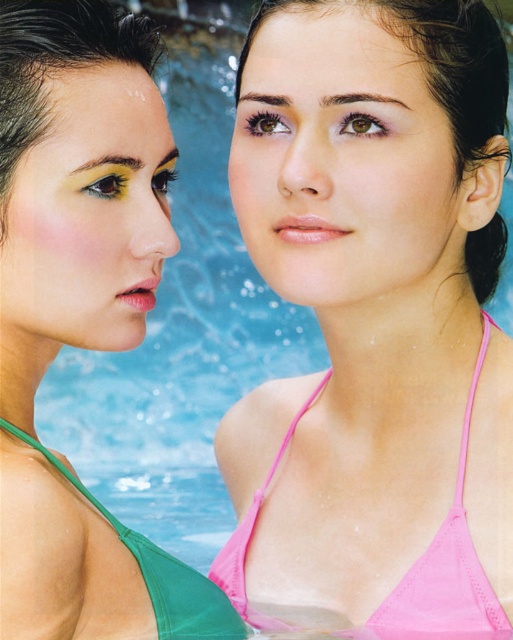
Question: Which is nearer to the matte pink bikini top at upper right?

Choices:
 (A) matte yellow eye makeup at left
 (B) pink fabric bikini top at center

Answer: (A)

Question: Does matte pink bikini top at upper right appear over green matte bikini top at lower left?

Choices:
 (A) no
 (B) yes

Answer: (B)

Question: Is matte yellow eye makeup at left positioned behind green matte bikini top at lower left?

Choices:
 (A) no
 (B) yes

Answer: (A)

Question: Which is farther from the pink fabric bikini top at center?

Choices:
 (A) matte yellow eye makeup at left
 (B) matte pink bikini top at upper right

Answer: (A)

Question: Which of these objects is positioned closest to the green matte bikini top at lower left?

Choices:
 (A) pink fabric bikini top at center
 (B) matte yellow eye makeup at left

Answer: (A)

Question: Where is matte yellow eye makeup at left located in relation to green matte bikini top at lower left in the image?

Choices:
 (A) right
 (B) left

Answer: (B)